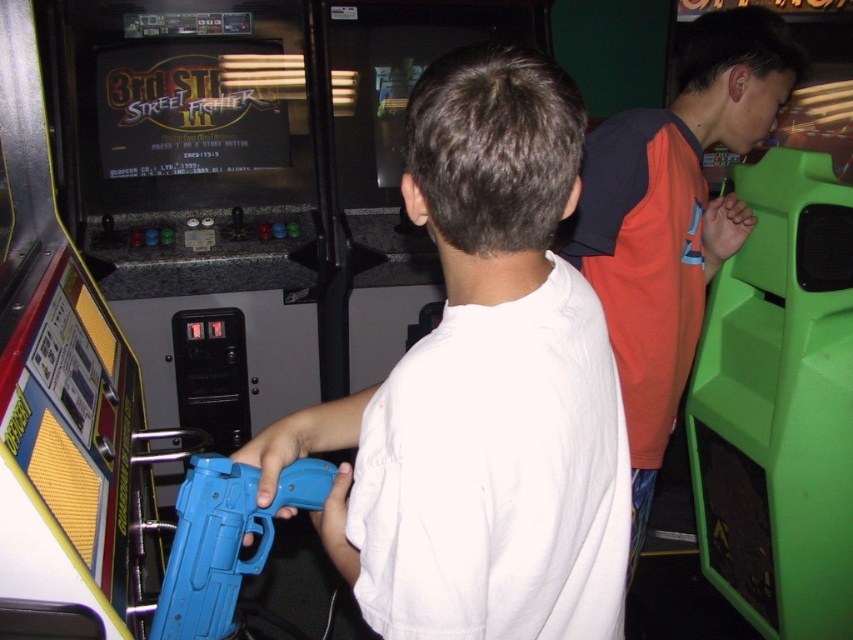
This screenshot has height=640, width=853. What do you see at coordinates (483, 388) in the screenshot? I see `white matte shirt at center` at bounding box center [483, 388].

Find the location of `white matte shirt at center`. white matte shirt at center is located at coordinates coord(483,388).

Find the location of a particular element. white matte shirt at center is located at coordinates (483, 388).

Between orange jersey at right and blue plastic toy gun at center, which one has more height?

orange jersey at right

In order to click on orange jersey at right in this screenshot , I will do `click(672, 218)`.

Is point (463, 74) positioned before point (248, 563)?

That is True.

Does white matte shirt at center have a smaller size compared to blue plastic toy gun at center?

Actually, white matte shirt at center might be larger than blue plastic toy gun at center.

Describe the element at coordinates (483, 388) in the screenshot. I see `white matte shirt at center` at that location.

Identify the location of white matte shirt at center. (483, 388).